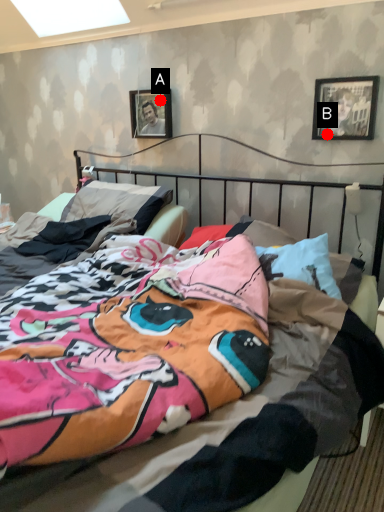
Question: Two points are circled on the image, labeled by A and B beside each circle. Which point appears farthest from the camera in this image?

Choices:
 (A) A is further
 (B) B is further

Answer: (A)